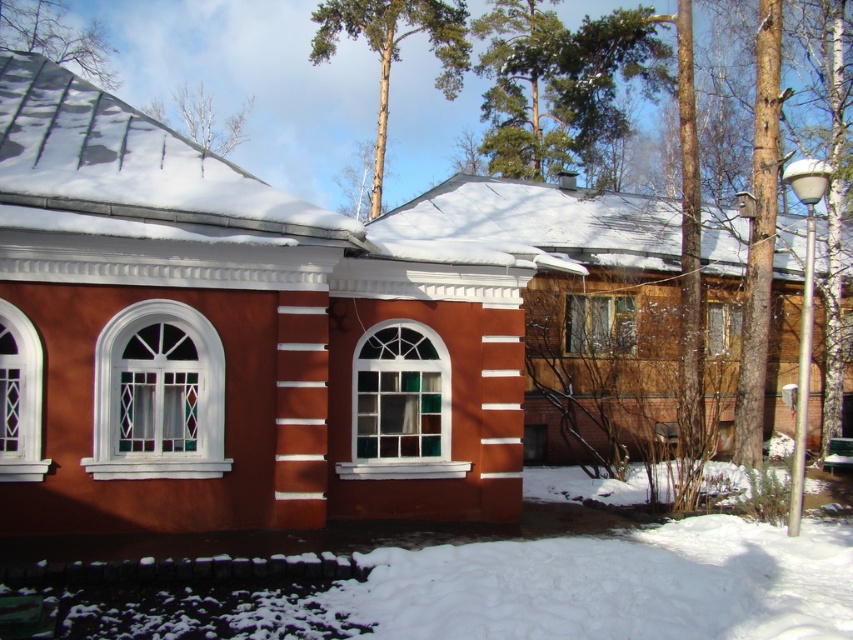
Is brown wood tree at upper center behind transparent glass window at center?

Yes, it is.

Where is `brown wood tree at upper center`? brown wood tree at upper center is located at coordinates (393, 49).

Does point (428, 8) come closer to viewer compared to point (242, 134)?

Yes, point (428, 8) is closer to viewer.

Where is `brown wood tree at upper center`? This screenshot has width=853, height=640. brown wood tree at upper center is located at coordinates (393, 49).

Is white glass window at center wider than white glass window at left?

Indeed, white glass window at center has a greater width compared to white glass window at left.

Can you confirm if white glass window at center is taller than white glass window at left?

Indeed, white glass window at center has a greater height compared to white glass window at left.

Locate an element on the screen. This screenshot has width=853, height=640. white glass window at center is located at coordinates (158, 396).